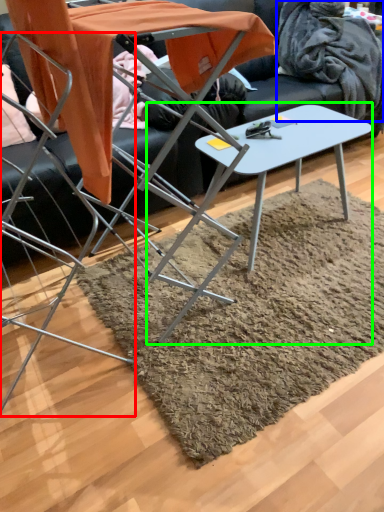
Question: Estimate the real-world distances between objects in this image. Which object is farther from chair (highlighted by a red box), blanket (highlighted by a blue box) or table (highlighted by a green box)?

Choices:
 (A) blanket
 (B) table

Answer: (A)